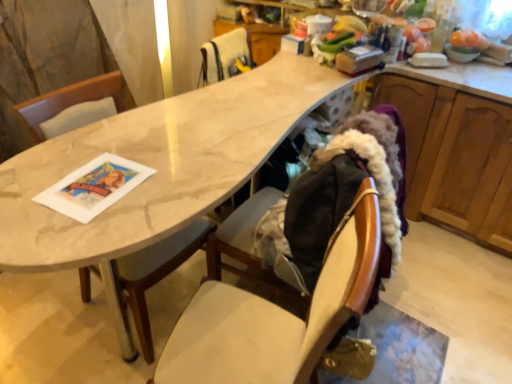
Question: Should I look upward or downward to see wooden chair at center, arranged as the first chair when ordered from the bottom?

Choices:
 (A) down
 (B) up

Answer: (A)

Question: Does wooden chair at center, arranged as the 2th chair when viewed from the back, have a lesser height compared to white fur at upper center, acting as the 2th chair starting from the bottom?

Choices:
 (A) yes
 (B) no

Answer: (B)

Question: Considering the relative sizes of wooden chair at center, which appears as the second chair when viewed from the top, and white fur at upper center, the 1th chair from the back, in the image provided, is wooden chair at center, which appears as the second chair when viewed from the top, wider than white fur at upper center, the 1th chair from the back,?

Choices:
 (A) yes
 (B) no

Answer: (A)

Question: From a real-world perspective, is wooden chair at center, arranged as the 2th chair when viewed from the back, beneath white fur at upper center, acting as the 2th chair starting from the bottom?

Choices:
 (A) no
 (B) yes

Answer: (B)

Question: Would you say wooden chair at center, which appears as the second chair when viewed from the top, contains white fur at upper center, acting as the 2th chair starting from the bottom?

Choices:
 (A) yes
 (B) no

Answer: (B)

Question: Is wooden chair at center, arranged as the 2th chair when viewed from the back, directly adjacent to white fur at upper center, positioned as the 2th chair in front-to-back order?

Choices:
 (A) no
 (B) yes

Answer: (A)

Question: From a real-world perspective, is wooden chair at center, the 1th chair in the front-to-back sequence, located higher than white fur at upper center, positioned as the 2th chair in front-to-back order?

Choices:
 (A) no
 (B) yes

Answer: (A)

Question: Does wooden chair at center, the 1th chair in the front-to-back sequence, come behind wooden cabinet at right?

Choices:
 (A) yes
 (B) no

Answer: (B)

Question: Considering the relative sizes of wooden chair at center, arranged as the first chair when ordered from the bottom, and wooden cabinet at right in the image provided, is wooden chair at center, arranged as the first chair when ordered from the bottom, taller than wooden cabinet at right?

Choices:
 (A) yes
 (B) no

Answer: (A)

Question: Considering the relative positions of wooden chair at center, arranged as the first chair when ordered from the bottom, and wooden cabinet at right in the image provided, is wooden chair at center, arranged as the first chair when ordered from the bottom, to the left of wooden cabinet at right from the viewer's perspective?

Choices:
 (A) yes
 (B) no

Answer: (A)

Question: From a real-world perspective, is wooden chair at center, arranged as the first chair when ordered from the bottom, physically below wooden cabinet at right?

Choices:
 (A) no
 (B) yes

Answer: (A)

Question: Is wooden cabinet at right inside wooden chair at center, arranged as the first chair when ordered from the bottom?

Choices:
 (A) no
 (B) yes

Answer: (A)

Question: From a real-world perspective, is wooden chair at center, arranged as the first chair when ordered from the bottom, positioned over wooden cabinet at right based on gravity?

Choices:
 (A) yes
 (B) no

Answer: (A)

Question: Is wooden chair at center, arranged as the first chair when ordered from the bottom, at the back of wooden cabinet at right?

Choices:
 (A) yes
 (B) no

Answer: (B)